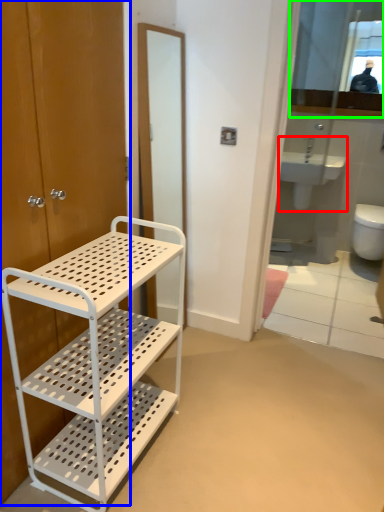
Question: Which object is positioned farthest from sink (highlighted by a red box)? Select from door (highlighted by a blue box) and mirror (highlighted by a green box).

Choices:
 (A) door
 (B) mirror

Answer: (A)